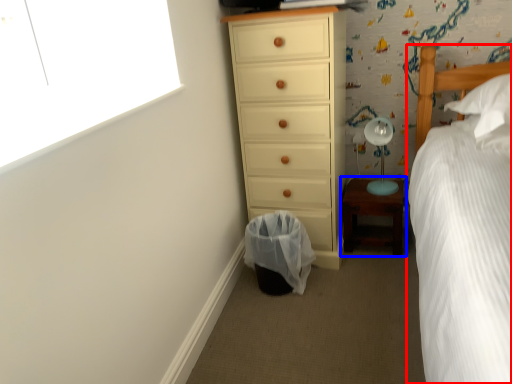
Question: Which point is closer to the camera, bed (highlighted by a red box) or nightstand (highlighted by a blue box)?

Choices:
 (A) bed
 (B) nightstand

Answer: (A)